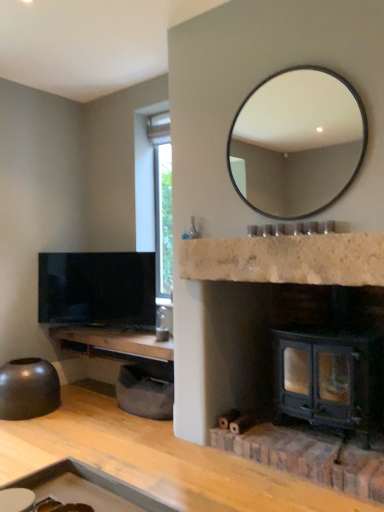
Question: Is woodenmaterial/texturecounter top at left, placed as the 2th counter top when sorted from front to back, thinner than white marble fireplace at center, the second counter top from the bottom?

Choices:
 (A) no
 (B) yes

Answer: (A)

Question: Is woodenmaterial/texturecounter top at left, placed as the 2th counter top when sorted from front to back, closer to the viewer compared to white marble fireplace at center, the first counter top in the top-to-bottom sequence?

Choices:
 (A) yes
 (B) no

Answer: (B)

Question: Does woodenmaterial/texturecounter top at left, placed as the 2th counter top when sorted from front to back, appear on the right side of white marble fireplace at center, arranged as the first counter top when viewed from the front?

Choices:
 (A) no
 (B) yes

Answer: (A)

Question: Is woodenmaterial/texturecounter top at left, acting as the 1th counter top starting from the back, oriented away from white marble fireplace at center, the first counter top in the top-to-bottom sequence?

Choices:
 (A) yes
 (B) no

Answer: (B)

Question: Is woodenmaterial/texturecounter top at left, the first counter top from the left, completely or partially outside of white marble fireplace at center, the second counter top from the bottom?

Choices:
 (A) no
 (B) yes

Answer: (B)

Question: Does woodenmaterial/texturecounter top at left, the first counter top from the left, have a larger size compared to white marble fireplace at center, marked as the 2th counter top in a back-to-front arrangement?

Choices:
 (A) no
 (B) yes

Answer: (B)

Question: Can you confirm if white marble fireplace at center, positioned as the 1th counter top in right-to-left order, is taller than woodenmaterial/texturecounter top at left, the first counter top positioned from the bottom?

Choices:
 (A) no
 (B) yes

Answer: (B)

Question: Is white marble fireplace at center, arranged as the first counter top when viewed from the front, far from woodenmaterial/texturecounter top at left, placed as the 2th counter top when sorted from front to back?

Choices:
 (A) no
 (B) yes

Answer: (B)

Question: Is white marble fireplace at center, positioned as the 2th counter top in left-to-right order, closer to the viewer compared to woodenmaterial/texturecounter top at left, which is the 2th counter top from top to bottom?

Choices:
 (A) yes
 (B) no

Answer: (A)

Question: Considering the relative sizes of white marble fireplace at center, marked as the 2th counter top in a back-to-front arrangement, and woodenmaterial/texturecounter top at left, which is the second counter top from right to left, in the image provided, is white marble fireplace at center, marked as the 2th counter top in a back-to-front arrangement, shorter than woodenmaterial/texturecounter top at left, which is the second counter top from right to left,?

Choices:
 (A) no
 (B) yes

Answer: (A)

Question: Could you tell me if white marble fireplace at center, marked as the 2th counter top in a back-to-front arrangement, is facing woodenmaterial/texturecounter top at left, which is the second counter top from right to left?

Choices:
 (A) yes
 (B) no

Answer: (B)

Question: From the image's perspective, does white marble fireplace at center, the second counter top from the bottom, appear higher than woodenmaterial/texturecounter top at left, the first counter top positioned from the bottom?

Choices:
 (A) no
 (B) yes

Answer: (B)

Question: Does matte black mirror at upper center turn towards matte black bowl at lower left?

Choices:
 (A) yes
 (B) no

Answer: (B)